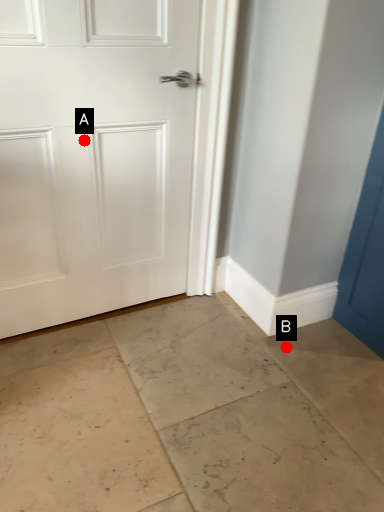
Question: Two points are circled on the image, labeled by A and B beside each circle. Which point appears closest to the camera in this image?

Choices:
 (A) A is closer
 (B) B is closer

Answer: (A)